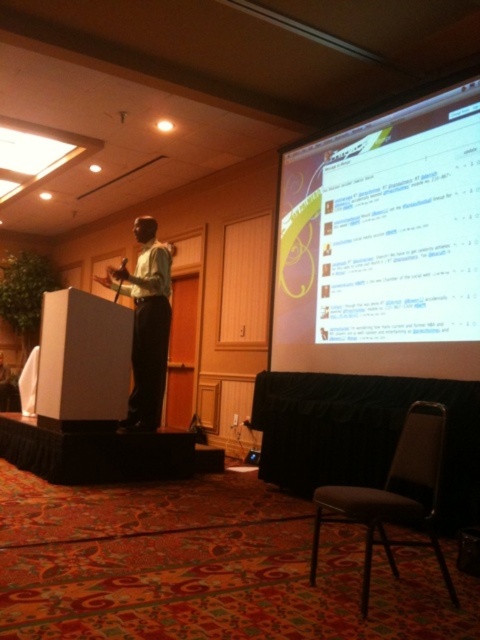
You are sitting in the gray fabric chair at lower right and want to move to the podium on the stage. Based on your current position, which direction should you move to reach the podium?

To reach the podium, you should move towards the left since the gray fabric chair at lower right is positioned at point (394, 496), which is to the right side of the stage area.

You are sitting in the gray fabric chair at lower right and want to hand a note to the person wearing the matte green shirt at center. Can you reach them directly without getting up?

The gray fabric chair at lower right is closer to the viewer than matte green shirt at center, so you can reach them directly without getting up.

You are sitting in the gray fabric chair at lower right and want to view the white glossy projection screen at upper right. Is the screen positioned above your head or below your line of sight?

The white glossy projection screen at upper right is located above the gray fabric chair at lower right, so it is positioned above your head.